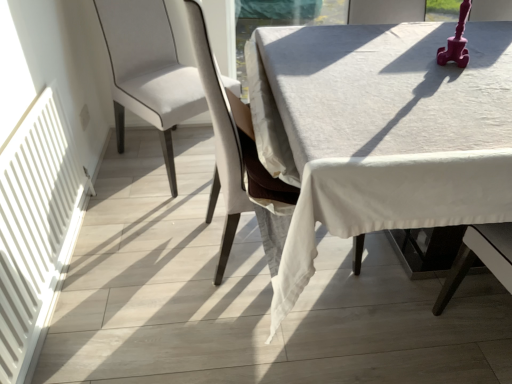
What do you see at coordinates (36, 228) in the screenshot? Image resolution: width=512 pixels, height=384 pixels. I see `white matte radiator at left` at bounding box center [36, 228].

This screenshot has width=512, height=384. What do you see at coordinates (148, 71) in the screenshot?
I see `satin white chair at center, which is the 1th chair in left-to-right order` at bounding box center [148, 71].

Locate an element on the screen. The width and height of the screenshot is (512, 384). white fabric chair at center, the 1th chair in the right-to-left sequence is located at coordinates (220, 139).

Is white fabric chair at center, the 1th chair in the right-to-left sequence, far away from satin white chair at center, which is the 1th chair in left-to-right order?

No, white fabric chair at center, the 1th chair in the right-to-left sequence, is not far away from satin white chair at center, which is the 1th chair in left-to-right order.

Is white fabric chair at center, the 1th chair in the right-to-left sequence, aimed at satin white chair at center, which is the 2th chair in right-to-left order?

No, white fabric chair at center, the 1th chair in the right-to-left sequence, is not facing towards satin white chair at center, which is the 2th chair in right-to-left order.

Can you confirm if white fabric chair at center, the 1th chair in the right-to-left sequence, is positioned to the left of satin white chair at center, which is the 1th chair in left-to-right order?

No.

Who is taller, white fabric chair at center, the 2th chair in the left-to-right sequence, or satin white chair at center, which is the 2th chair in right-to-left order?

white fabric chair at center, the 2th chair in the left-to-right sequence.

Is satin white chair at center, which is the 2th chair in right-to-left order, situated inside white matte radiator at left or outside?

satin white chair at center, which is the 2th chair in right-to-left order, lies outside white matte radiator at left.

From their relative heights in the image, would you say satin white chair at center, which is the 1th chair in left-to-right order, is taller or shorter than white matte radiator at left?

satin white chair at center, which is the 1th chair in left-to-right order, is taller than white matte radiator at left.

Which object is closer to the camera, satin white chair at center, which is the 1th chair in left-to-right order, or white matte radiator at left?

Positioned in front is white matte radiator at left.

Is white fabric chair at center, the 1th chair in the right-to-left sequence, situated inside white linen table at center or outside?

white fabric chair at center, the 1th chair in the right-to-left sequence, is spatially positioned inside white linen table at center.

From the picture: Which object is closer to the camera, white fabric chair at center, the 1th chair in the right-to-left sequence, or white linen table at center?

white linen table at center.

Considering the relative positions of white fabric chair at center, the 2th chair in the left-to-right sequence, and white linen table at center in the image provided, is white fabric chair at center, the 2th chair in the left-to-right sequence, to the right of white linen table at center from the viewer's perspective?

Incorrect, white fabric chair at center, the 2th chair in the left-to-right sequence, is not on the right side of white linen table at center.

Can you confirm if white linen table at center is smaller than satin white chair at center, which is the 1th chair in left-to-right order?

Incorrect, white linen table at center is not smaller in size than satin white chair at center, which is the 1th chair in left-to-right order.

Considering the relative sizes of white linen table at center and satin white chair at center, which is the 2th chair in right-to-left order, in the image provided, is white linen table at center wider than satin white chair at center, which is the 2th chair in right-to-left order,?

Correct, the width of white linen table at center exceeds that of satin white chair at center, which is the 2th chair in right-to-left order.

Is white linen table at center aimed at satin white chair at center, which is the 1th chair in left-to-right order?

No, white linen table at center is not oriented towards satin white chair at center, which is the 1th chair in left-to-right order.

Are white linen table at center and satin white chair at center, which is the 1th chair in left-to-right order, beside each other?

No, white linen table at center is not with satin white chair at center, which is the 1th chair in left-to-right order.

From the white matte radiator at left, count 2nd chair to the right and point to it. Please provide its 2D coordinates.

[(220, 139)]

Considering the sizes of white fabric chair at center, the 1th chair in the right-to-left sequence, and white matte radiator at left in the image, is white fabric chair at center, the 1th chair in the right-to-left sequence, taller or shorter than white matte radiator at left?

white fabric chair at center, the 1th chair in the right-to-left sequence, is taller than white matte radiator at left.

Considering the sizes of white fabric chair at center, the 1th chair in the right-to-left sequence, and white matte radiator at left in the image, is white fabric chair at center, the 1th chair in the right-to-left sequence, wider or thinner than white matte radiator at left?

Clearly, white fabric chair at center, the 1th chair in the right-to-left sequence, has more width compared to white matte radiator at left.

Between point (205, 49) and point (68, 148), which one is positioned in front?

The point (205, 49) is closer to the camera.

Consider the image. Who is taller, satin white chair at center, which is the 2th chair in right-to-left order, or white fabric chair at center, the 2th chair in the left-to-right sequence?

white fabric chair at center, the 2th chair in the left-to-right sequence.

How different are the orientations of satin white chair at center, which is the 2th chair in right-to-left order, and white fabric chair at center, the 1th chair in the right-to-left sequence, in degrees?

The angular difference between satin white chair at center, which is the 2th chair in right-to-left order, and white fabric chair at center, the 1th chair in the right-to-left sequence, is 52.5 degrees.

Is the surface of satin white chair at center, which is the 2th chair in right-to-left order, in direct contact with white fabric chair at center, the 1th chair in the right-to-left sequence?

No, satin white chair at center, which is the 2th chair in right-to-left order, is not with white fabric chair at center, the 1th chair in the right-to-left sequence.

Considering the positions of objects satin white chair at center, which is the 2th chair in right-to-left order, and white fabric chair at center, the 1th chair in the right-to-left sequence, in the image provided, who is more to the left, satin white chair at center, which is the 2th chair in right-to-left order, or white fabric chair at center, the 1th chair in the right-to-left sequence,?

Positioned to the left is satin white chair at center, which is the 2th chair in right-to-left order.

At what (x,y) coordinates should I click in order to perform the action: click on radiator on the left of white linen table at center. Please return your answer as a coordinate pair (x, y). The height and width of the screenshot is (384, 512). Looking at the image, I should click on (36, 228).

Does white matte radiator at left turn towards white linen table at center?

Yes, white matte radiator at left is oriented towards white linen table at center.

Is white matte radiator at left smaller than white linen table at center?

Yes.

In the scene shown: Is white matte radiator at left beside white linen table at center?

white matte radiator at left and white linen table at center are not in contact.

Locate an element on the screen. The width and height of the screenshot is (512, 384). chair above the satin white chair at center, which is the 2th chair in right-to-left order (from a real-world perspective) is located at coordinates [220, 139].

This screenshot has width=512, height=384. Identify the location of radiator below the satin white chair at center, which is the 2th chair in right-to-left order (from the image's perspective). (36, 228).

Based on their spatial positions, is white fabric chair at center, the 1th chair in the right-to-left sequence, or white linen table at center closer to satin white chair at center, which is the 2th chair in right-to-left order?

white fabric chair at center, the 1th chair in the right-to-left sequence.

Based on their spatial positions, is white linen table at center or white fabric chair at center, the 2th chair in the left-to-right sequence, closer to white matte radiator at left?

The object closer to white matte radiator at left is white fabric chair at center, the 2th chair in the left-to-right sequence.

From the image, which object appears to be nearer to satin white chair at center, which is the 2th chair in right-to-left order, white linen table at center or white fabric chair at center, the 1th chair in the right-to-left sequence?

white fabric chair at center, the 1th chair in the right-to-left sequence.

From the image, which object appears to be farther from white fabric chair at center, the 1th chair in the right-to-left sequence, white matte radiator at left or white linen table at center?

Among the two, white matte radiator at left is located further to white fabric chair at center, the 1th chair in the right-to-left sequence.

From the image, which object appears to be farther from satin white chair at center, which is the 2th chair in right-to-left order, white matte radiator at left or white fabric chair at center, the 2th chair in the left-to-right sequence?

white fabric chair at center, the 2th chair in the left-to-right sequence, is positioned further to the anchor satin white chair at center, which is the 2th chair in right-to-left order.

Consider the image. Estimate the real-world distances between objects in this image. Which object is closer to white linen table at center, white fabric chair at center, the 1th chair in the right-to-left sequence, or satin white chair at center, which is the 1th chair in left-to-right order?

white fabric chair at center, the 1th chair in the right-to-left sequence, is positioned closer to the anchor white linen table at center.

Which object lies nearer to the anchor point white matte radiator at left, white linen table at center or satin white chair at center, which is the 2th chair in right-to-left order?

Among the two, satin white chair at center, which is the 2th chair in right-to-left order, is located nearer to white matte radiator at left.

From the image, which object appears to be farther from white fabric chair at center, the 1th chair in the right-to-left sequence, satin white chair at center, which is the 2th chair in right-to-left order, or white linen table at center?

satin white chair at center, which is the 2th chair in right-to-left order, is positioned further to the anchor white fabric chair at center, the 1th chair in the right-to-left sequence.

Find the location of a particular element. The height and width of the screenshot is (384, 512). chair situated between satin white chair at center, which is the 2th chair in right-to-left order, and white linen table at center from left to right is located at coordinates (220, 139).

Where is `chair located between white matte radiator at left and satin white chair at center, which is the 2th chair in right-to-left order, in the depth direction`? The width and height of the screenshot is (512, 384). chair located between white matte radiator at left and satin white chair at center, which is the 2th chair in right-to-left order, in the depth direction is located at coordinates (220, 139).